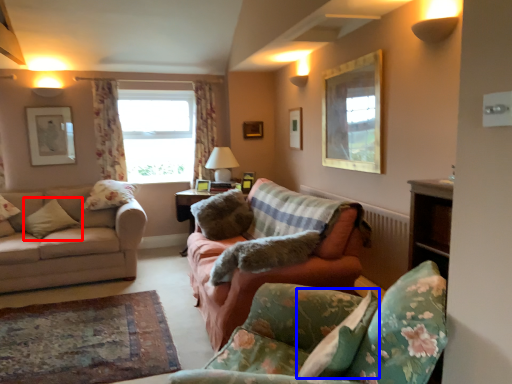
Question: Which point is closer to the camera, pillow (highlighted by a red box) or pillow (highlighted by a blue box)?

Choices:
 (A) pillow
 (B) pillow

Answer: (B)